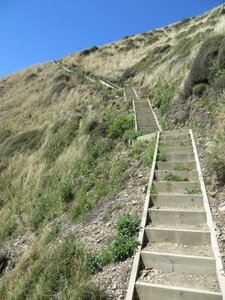
I want to click on 4th stair, so click(x=183, y=211).